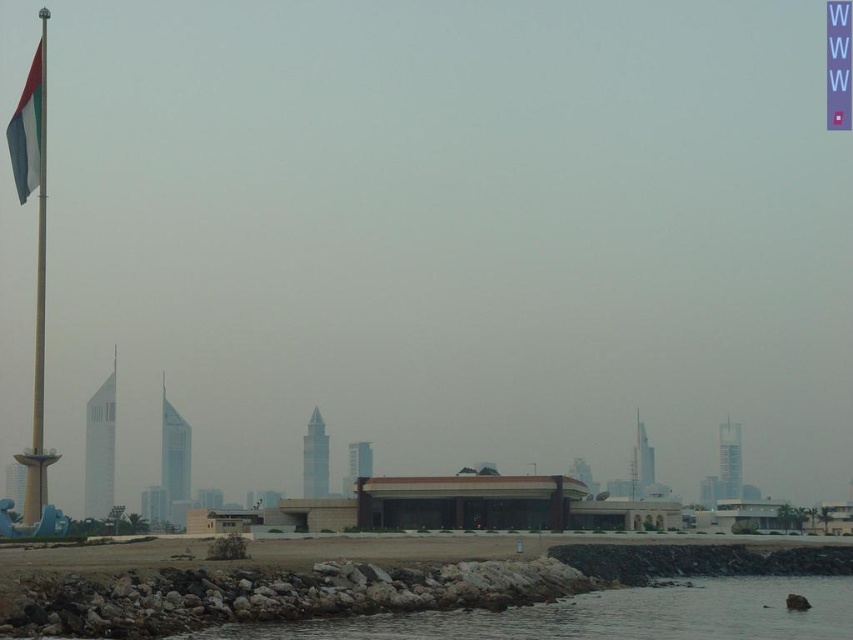
Question: Considering the relative positions of gray rocky water at lower left and white fabric flag at left in the image provided, where is gray rocky water at lower left located with respect to white fabric flag at left?

Choices:
 (A) below
 (B) above

Answer: (A)

Question: Does gray rocky water at lower left come behind white fabric flag at left?

Choices:
 (A) yes
 (B) no

Answer: (B)

Question: Which of the following is the closest to the observer?

Choices:
 (A) white fabric flag at left
 (B) polished metal flag pole at left
 (C) gray rocky water at lower left

Answer: (C)

Question: Is gray rocky water at lower left smaller than polished metal flag pole at left?

Choices:
 (A) no
 (B) yes

Answer: (B)

Question: Among these points, which one is nearest to the camera?

Choices:
 (A) (32, 157)
 (B) (41, 177)
 (C) (474, 621)

Answer: (C)

Question: Which of the following is the farthest from the observer?

Choices:
 (A) white fabric flag at left
 (B) gray rocky water at lower left
 (C) polished metal flag pole at left

Answer: (A)